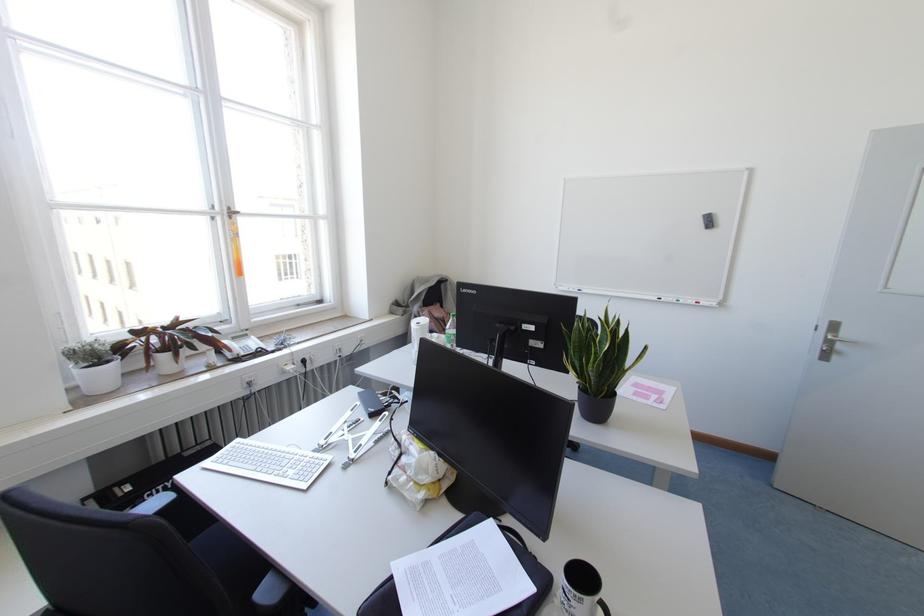
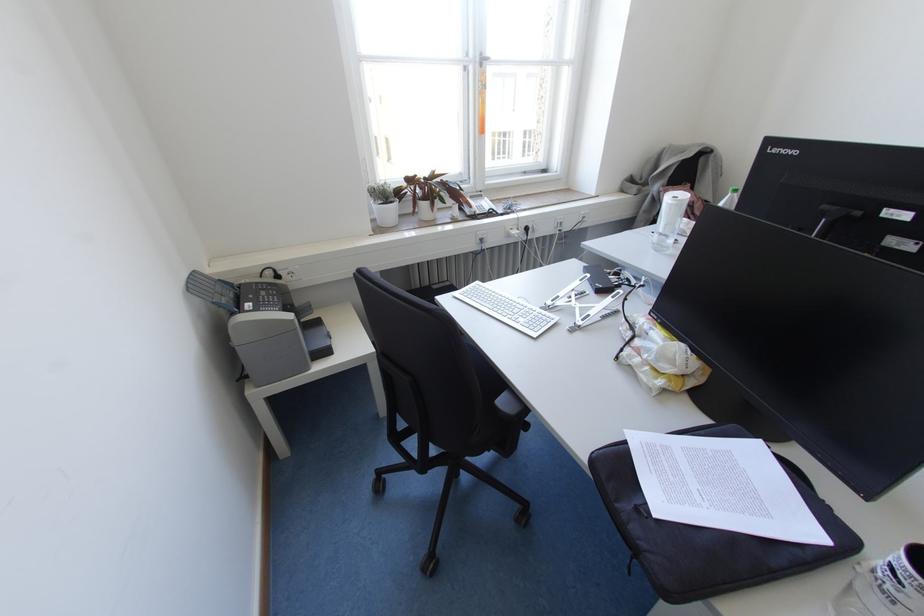
Where in the second image is the point corresponding to point 229,217 from the first image?

(480, 65)